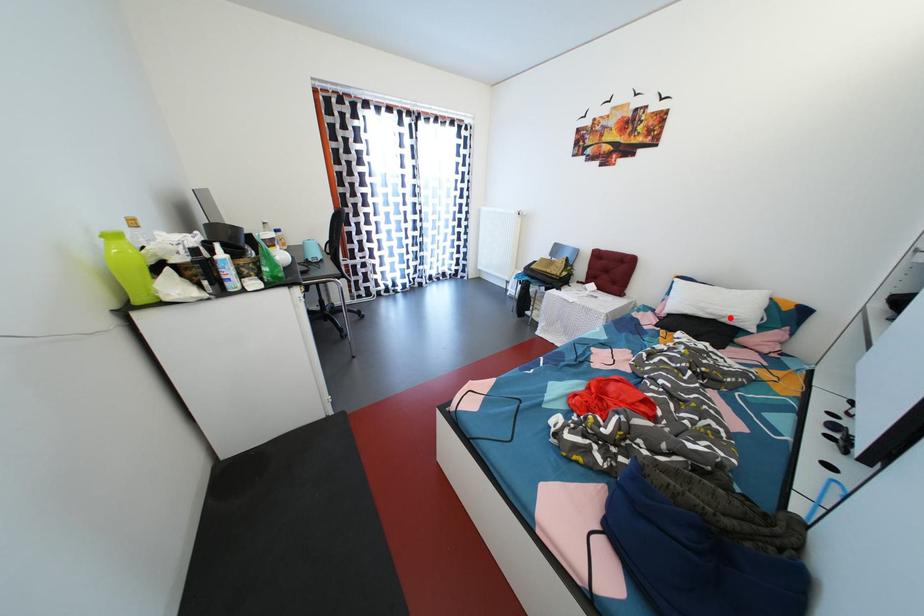
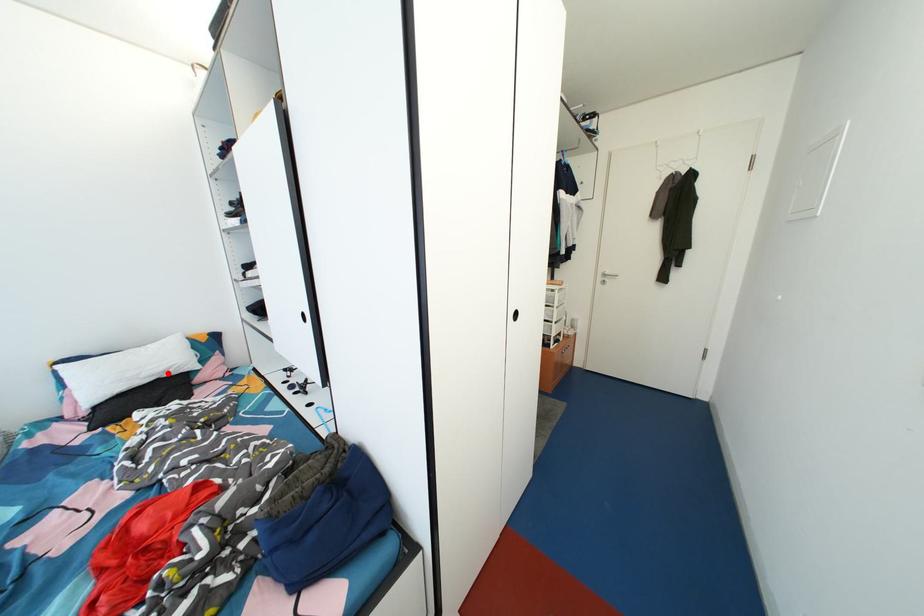
I am providing you with two images of the same scene from different viewpoints. A red point is marked on the first image and another point is marked on the second image. Is the red point in image1 aligned with the point shown in image2?

Yes